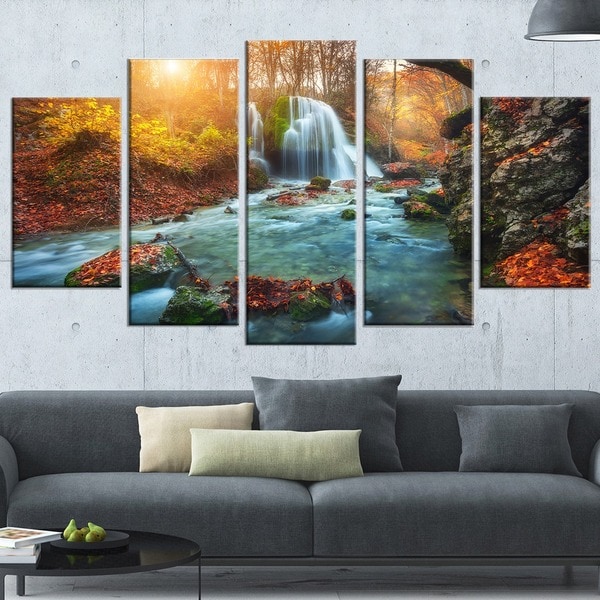
Identify the location of table legs. (199, 589), (20, 585), (2, 580).